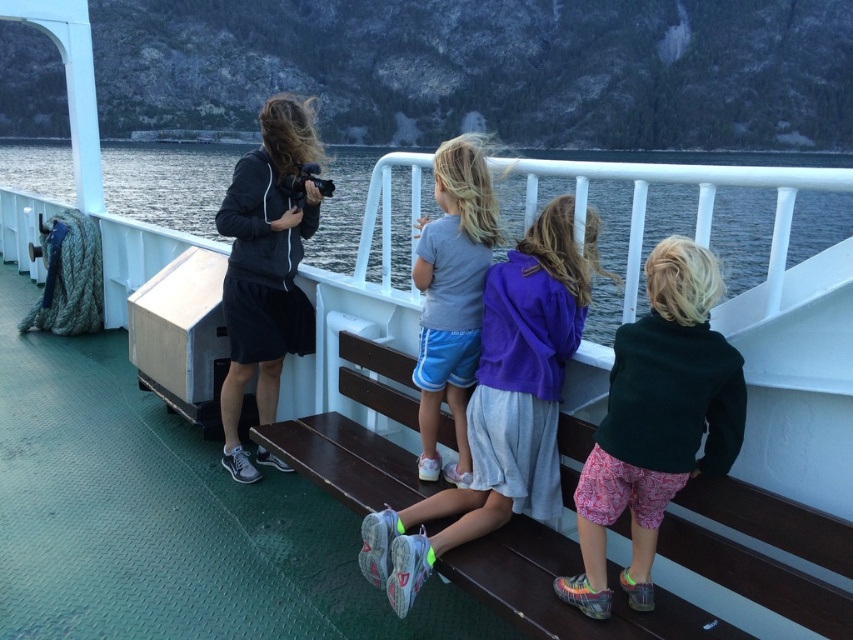
Which is in front, point (286, 337) or point (482, 164)?

Positioned in front is point (482, 164).

Does matte black jacket at center come behind light gray cotton shirt at center?

Yes, it is.

Identify the location of matte black jacket at center. The width and height of the screenshot is (853, 640). (265, 266).

Where is `matte black jacket at center`? This screenshot has width=853, height=640. matte black jacket at center is located at coordinates (265, 266).

Is point (376, 221) positioned before point (387, 598)?

No.

Is clear water at upper left wider than gray fabric shorts at center?

Yes.

Is point (223, 164) more distant than point (547, 260)?

Yes, point (223, 164) is behind point (547, 260).

This screenshot has height=640, width=853. Identify the location of clear water at upper left. (167, 182).

Does point (680, 193) lie behind point (592, 518)?

Yes, point (680, 193) is farther from viewer.

Which is in front, point (544, 198) or point (587, 488)?

Point (587, 488) is more forward.

Where is `clear water at upper left`? This screenshot has width=853, height=640. clear water at upper left is located at coordinates (167, 182).

Find the location of a particular element. The height and width of the screenshot is (640, 853). clear water at upper left is located at coordinates (167, 182).